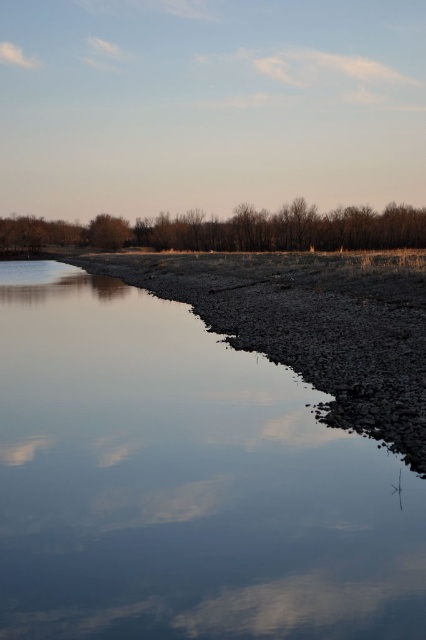
Is smooth reflective water at center to the right of brown textured trees at upper center from the viewer's perspective?

Indeed, smooth reflective water at center is positioned on the right side of brown textured trees at upper center.

Does smooth reflective water at center appear on the left side of brown textured trees at upper center?

In fact, smooth reflective water at center is to the right of brown textured trees at upper center.

Is point (388, 627) positioned behind point (26, 230)?

No, it is not.

The height and width of the screenshot is (640, 426). Find the location of `smooth reflective water at center`. smooth reflective water at center is located at coordinates (184, 483).